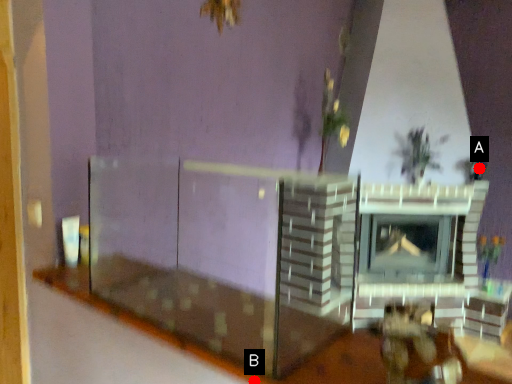
Question: Two points are circled on the image, labeled by A and B beside each circle. Which point is farther to the camera?

Choices:
 (A) A is further
 (B) B is further

Answer: (A)